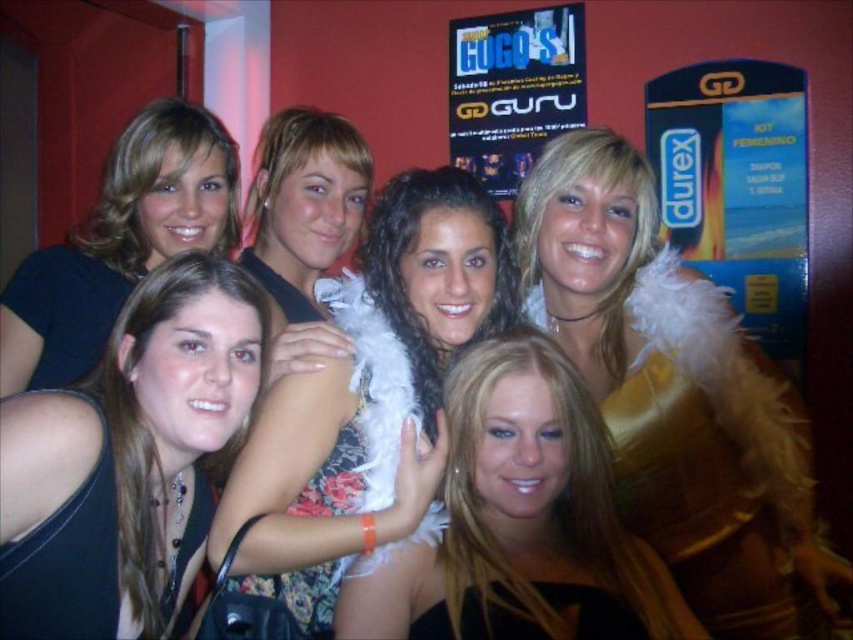
Question: Is gold shiny feather boa at upper center bigger than shiny black dress at center?

Choices:
 (A) no
 (B) yes

Answer: (B)

Question: Is fluffy white boa at center to the left of black fabric dress at center from the viewer's perspective?

Choices:
 (A) no
 (B) yes

Answer: (A)

Question: Is gold shiny feather boa at upper center in front of fluffy white boa at center?

Choices:
 (A) no
 (B) yes

Answer: (A)

Question: Which object is the farthest from the gold shiny feather boa at upper center?

Choices:
 (A) fluffy white boa at center
 (B) black fabric dress at center

Answer: (B)

Question: Which of the following is the closest to the observer?

Choices:
 (A) gold shiny feather boa at upper center
 (B) matte black shirt at upper left
 (C) black fabric dress at center

Answer: (C)

Question: Which point is farther to the camera?

Choices:
 (A) (177, 440)
 (B) (131, 236)
 (C) (529, 397)

Answer: (B)